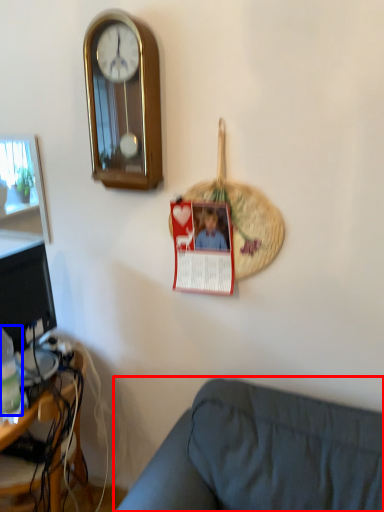
Question: Which object is further to the camera taking this photo, studio couch (highlighted by a red box) or bottle (highlighted by a blue box)?

Choices:
 (A) studio couch
 (B) bottle

Answer: (B)